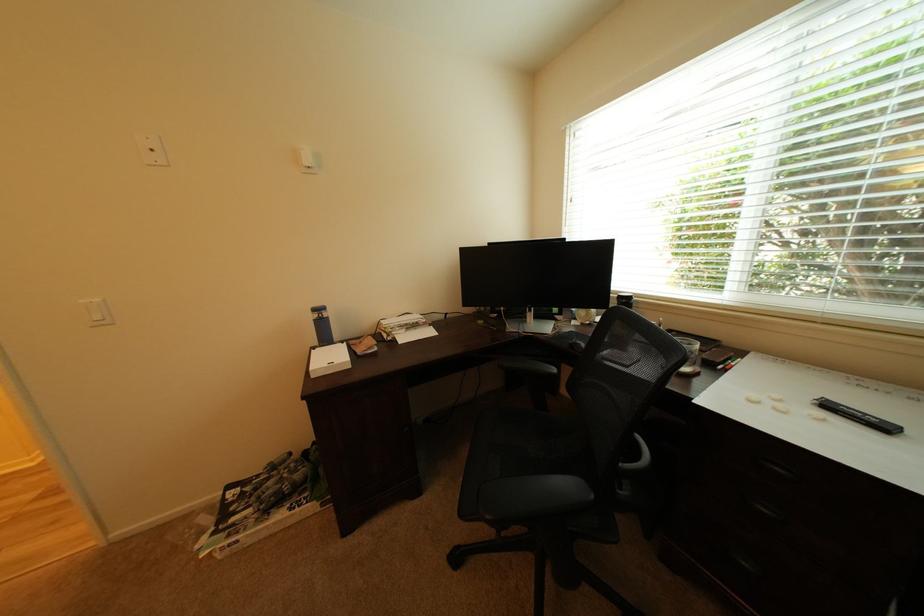
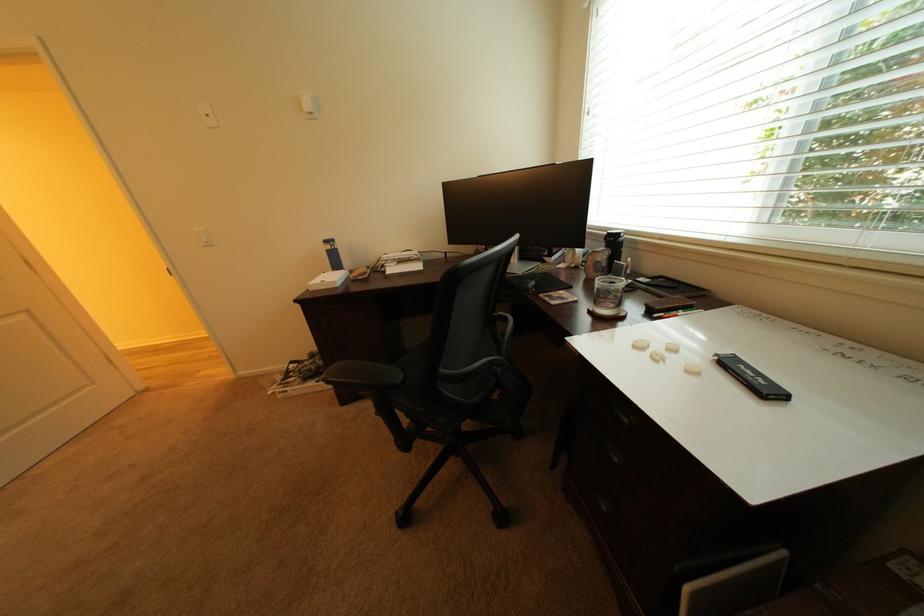
Question: The first image is from the beginning of the video and the second image is from the end. How did the camera likely rotate when shooting the video?

Choices:
 (A) Left
 (B) Right
 (C) Up
 (D) Down

Answer: (A)